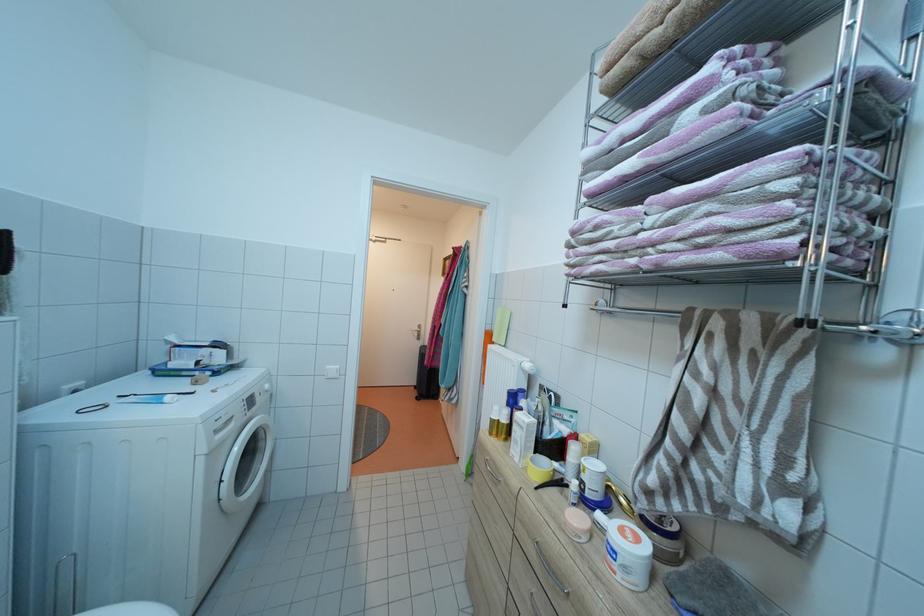
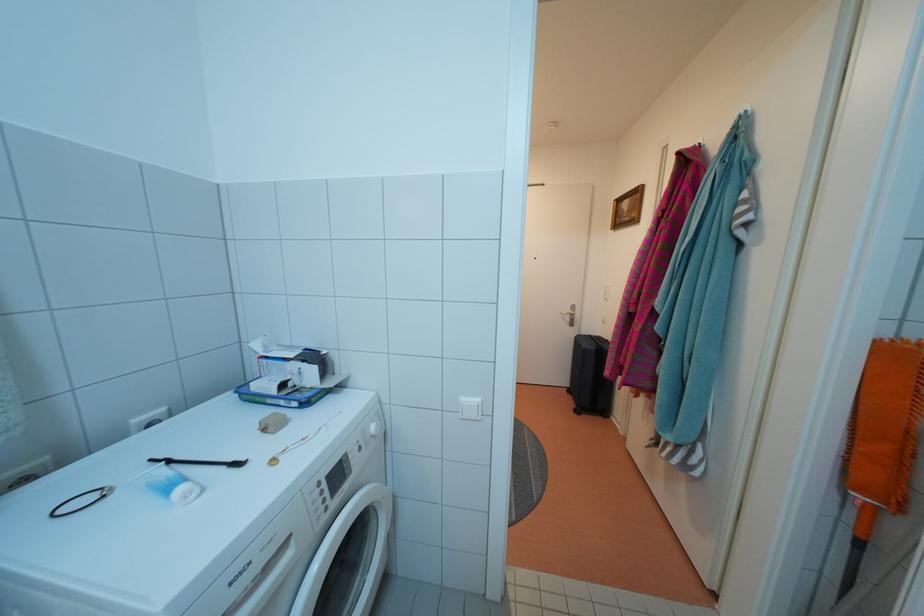
In the second image, find the point that corresponds to the point at 199,371 in the first image.

(282, 398)